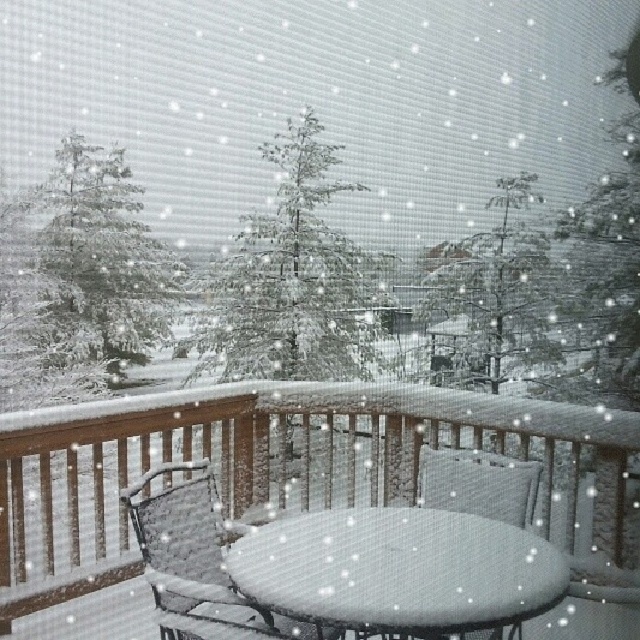
Which is more to the right, snow-covered pine tree at center or woven fabric chair at center?

woven fabric chair at center is more to the right.

Is snow-covered pine tree at center closer to the viewer compared to woven fabric chair at center?

Yes.

Who is more distant from viewer, (536,182) or (493,493)?

The point (493,493) is behind.

Find the location of a particular element. snow-covered pine tree at center is located at coordinates (492, 292).

Can you confirm if green textured evergreen tree at center is positioned to the right of snow-covered pine tree at center?

In fact, green textured evergreen tree at center is to the left of snow-covered pine tree at center.

Is point (307, 360) positioned behind point (502, 214)?

Yes.

What are the coordinates of `green textured evergreen tree at center` in the screenshot? It's located at (292, 276).

The image size is (640, 640). Describe the element at coordinates (397, 570) in the screenshot. I see `white textured table at center` at that location.

The height and width of the screenshot is (640, 640). Find the location of `white textured table at center`. white textured table at center is located at coordinates (397, 570).